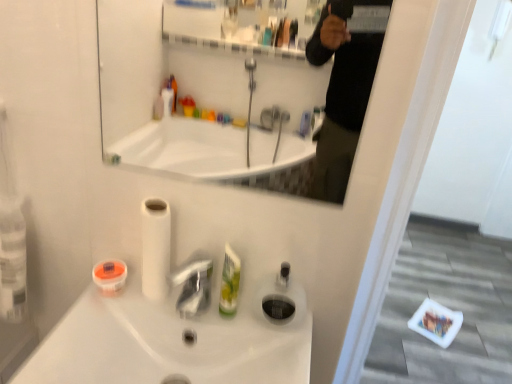
This screenshot has width=512, height=384. I want to click on unoccupied region to the right of orange matte container at lower left, the 2th mouthwash when ordered from right to left, so click(x=176, y=313).